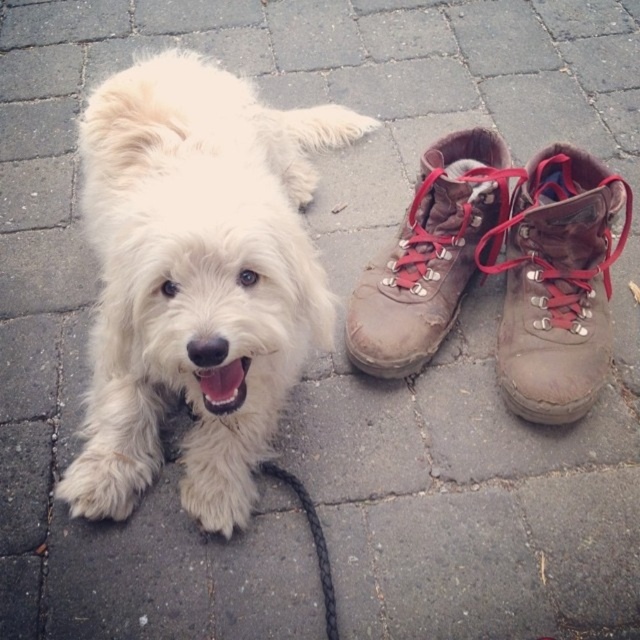
You are a hiker who just finished a long hike and see the brown leather boot at right and the brown leather boot at center. Which one is closer to you?

The brown leather boot at right is closer to you because it is in front of the brown leather boot at center.